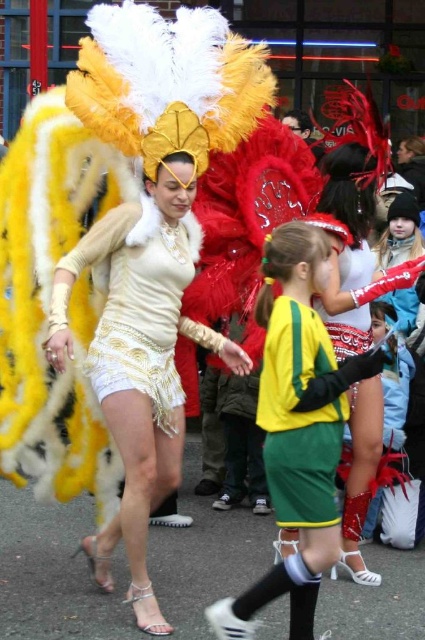
How far apart are yellow-green jersey at center and green jersey at center?

They are 3.36 inches apart.

Which is behind, point (289, 337) or point (283, 403)?

Point (289, 337)

Where is `yellow-green jersey at center`? yellow-green jersey at center is located at coordinates (297, 428).

Which is more to the right, yellow-green jersey at center or shiny gold sequined dress at center?

From the viewer's perspective, yellow-green jersey at center appears more on the right side.

This screenshot has height=640, width=425. What do you see at coordinates (297, 428) in the screenshot? I see `yellow-green jersey at center` at bounding box center [297, 428].

Where is `yellow-green jersey at center`? The image size is (425, 640). yellow-green jersey at center is located at coordinates (297, 428).

Image resolution: width=425 pixels, height=640 pixels. Describe the element at coordinates (141, 358) in the screenshot. I see `matte gold dress at center` at that location.

From the picture: Does matte gold dress at center appear on the right side of shiny gold sequined dress at center?

Yes, matte gold dress at center is to the right of shiny gold sequined dress at center.

Is point (56, 269) less distant than point (113, 285)?

Yes, it is in front of point (113, 285).

The image size is (425, 640). In order to click on matte gold dress at center in this screenshot , I will do `click(141, 358)`.